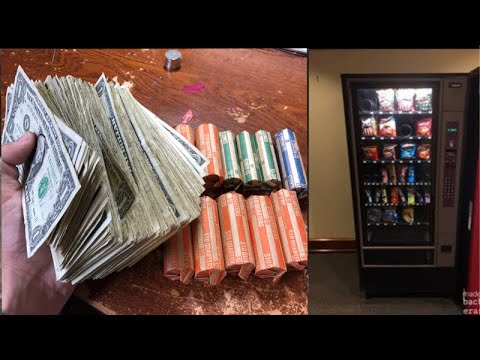
The height and width of the screenshot is (360, 480). Find the location of `floor`. floor is located at coordinates (341, 288).